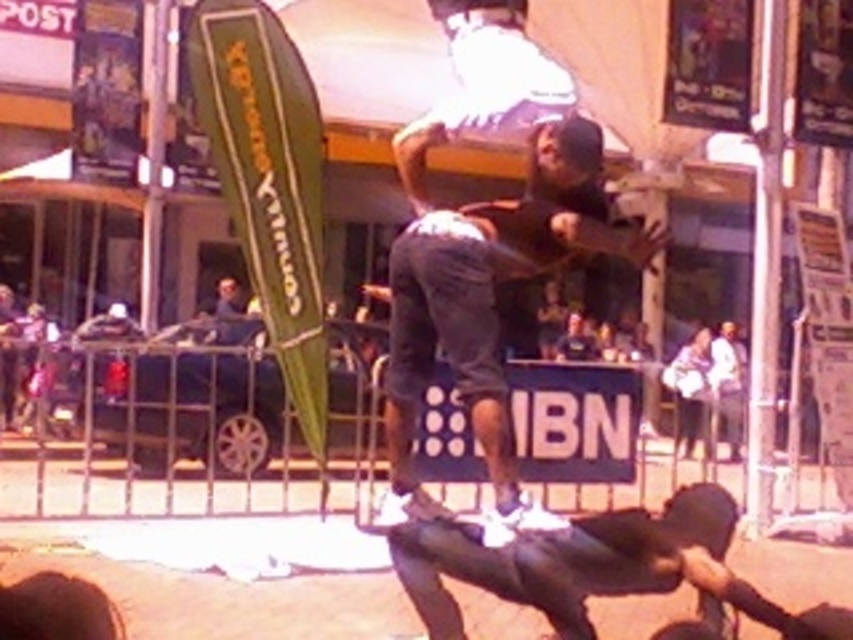
Does dark gray denim shorts at center have a greater width compared to dark gray matte skateboard at lower center?

No, dark gray denim shorts at center is not wider than dark gray matte skateboard at lower center.

Is dark gray denim shorts at center shorter than dark gray matte skateboard at lower center?

No.

In order to click on dark gray denim shorts at center in this screenshot , I will do click(x=488, y=294).